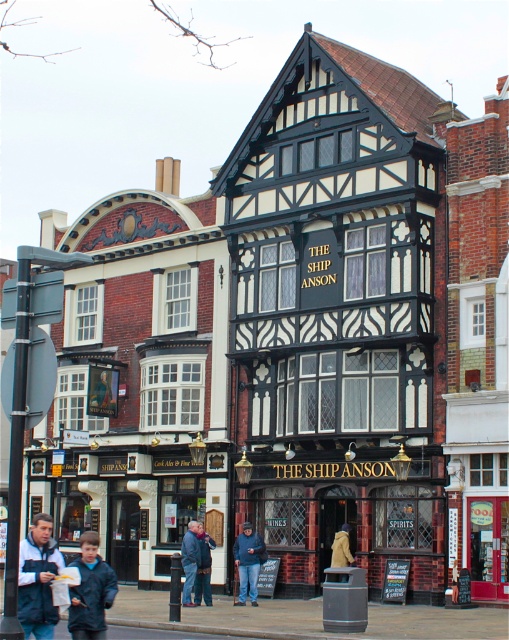
You are a photographer trying to capture the entire matte black pub at center and dark blue jeans at center in one frame. Given that your camera can only fit objects up to the width of the wider object in the scene, will both objects fit in the frame?

The matte black pub at center is wider than the dark blue jeans at center. Since the camera can accommodate the width of the wider object, both objects will fit in the frame as the pub is wider and the jeans are narrower.

You are standing in front of The Ship Anson building. There are two points marked on the building facade. The first point is at coordinate (x=295, y=465) and the second at (x=184, y=600). Which point is closer to you?

Point (x=184, y=600) is closer to you because it is less further to the camera than point (x=295, y=465).